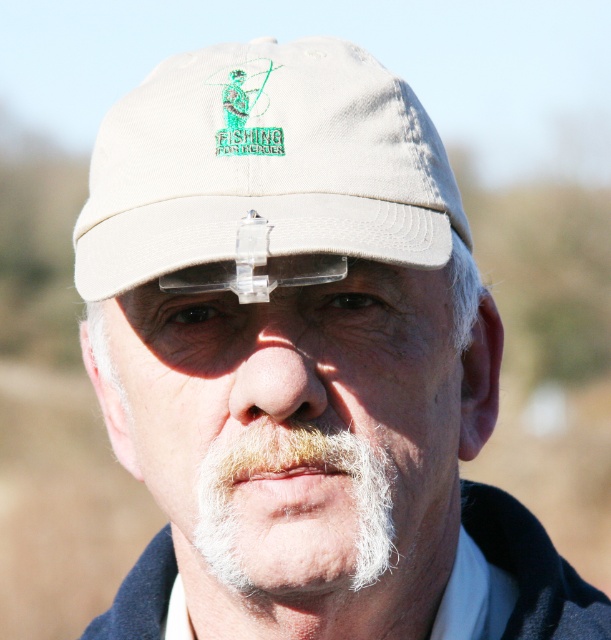
Question: Is beige fabric baseball cap at center further to the viewer compared to white fuzzy beard at lower center?

Choices:
 (A) yes
 (B) no

Answer: (B)

Question: Does beige fabric baseball cap at center appear under white fuzzy beard at lower center?

Choices:
 (A) yes
 (B) no

Answer: (B)

Question: Is beige fabric baseball cap at center to the left of white fuzzy beard at lower center from the viewer's perspective?

Choices:
 (A) yes
 (B) no

Answer: (A)

Question: Which point is farther to the camera?

Choices:
 (A) beige fabric baseball cap at center
 (B) white fuzzy beard at lower center

Answer: (B)

Question: Which object appears farthest from the camera in this image?

Choices:
 (A) white fuzzy beard at lower center
 (B) beige fabric baseball cap at center

Answer: (A)